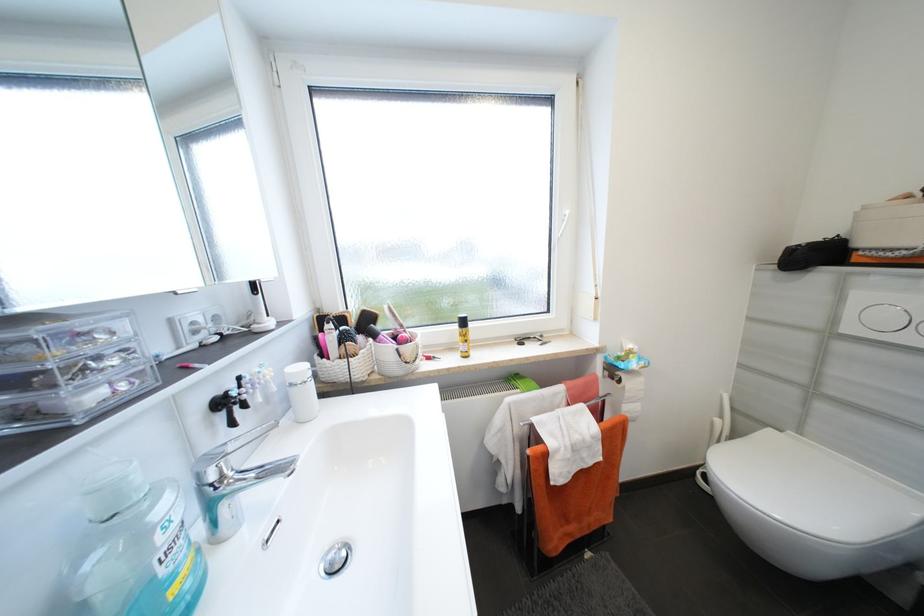
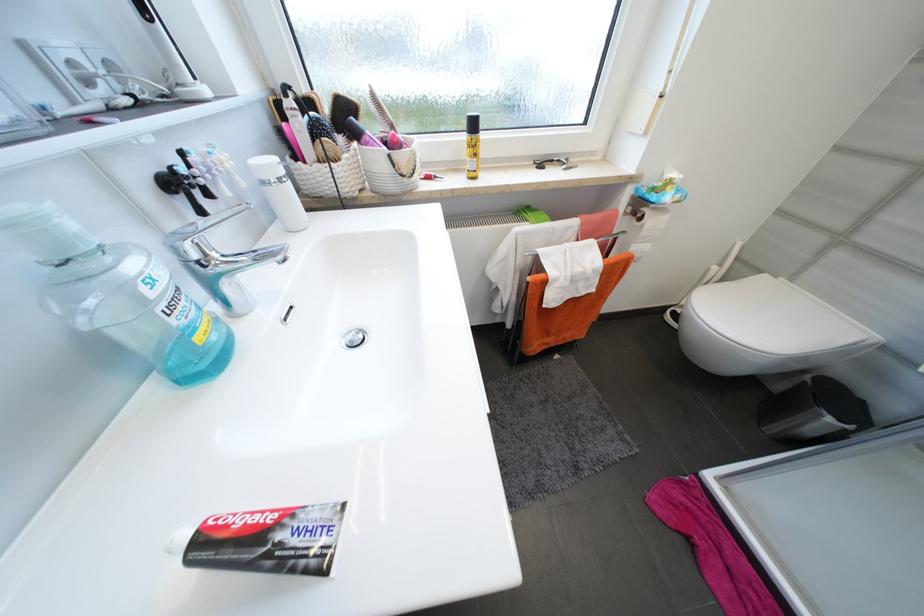
Find the pixel in the second image that matches [330,357] in the first image.

(304, 158)